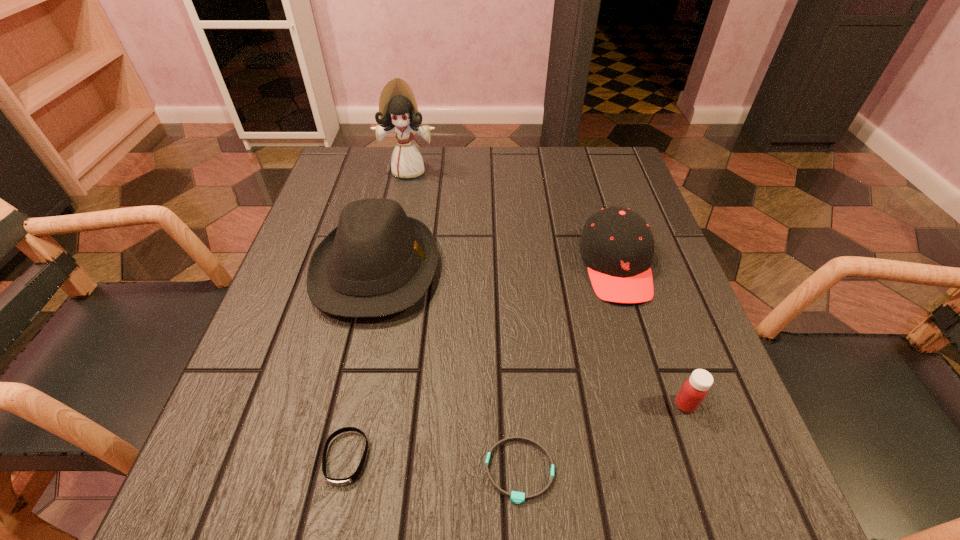
Find the location of a particular element. This screenshot has width=960, height=540. vacant position in the image that satisfies the following two spatial constraints: 1. on the front-facing side of the second tallest object; 2. on the right side of the medicine is located at coordinates (345, 404).

At what (x,y) coordinates should I click in order to perform the action: click on free location that satisfies the following two spatial constraints: 1. on the front-facing side of the cap; 2. on the front-facing side of the second tallest object. Please return your answer as a coordinate pair (x, y). The width and height of the screenshot is (960, 540). Looking at the image, I should click on (617, 269).